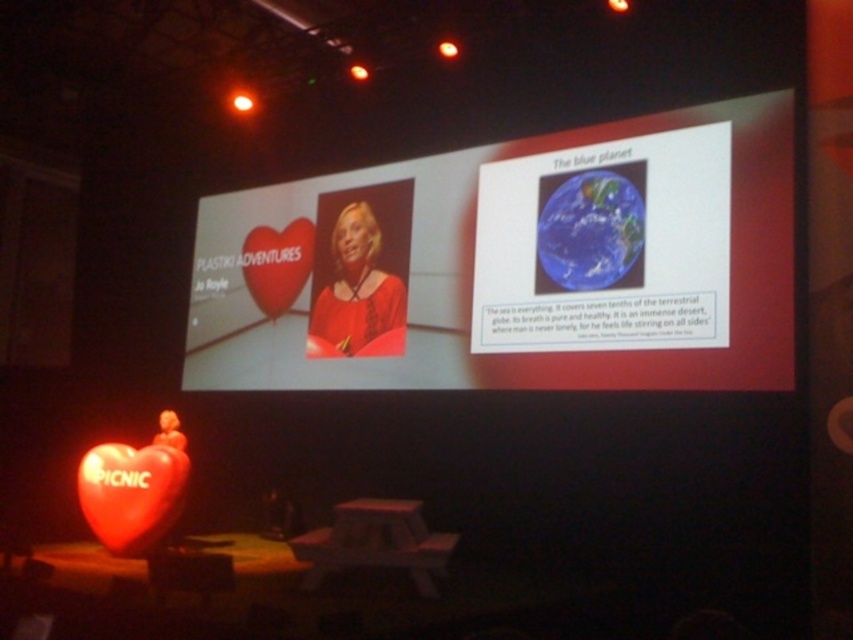
Question: Is white glossy projection screen at upper center in front of blue glossy earth at upper right?

Choices:
 (A) yes
 (B) no

Answer: (A)

Question: Based on their relative distances, which object is nearer to the blue glossy earth at upper right?

Choices:
 (A) matte red heart at center
 (B) white glossy projection screen at upper center

Answer: (B)

Question: Can you confirm if blue glossy earth at upper right is thinner than matte red heart at center?

Choices:
 (A) yes
 (B) no

Answer: (A)

Question: Which point is closer to the camera?

Choices:
 (A) (349, 198)
 (B) (567, 240)
 (C) (265, 276)

Answer: (B)

Question: Which point is closer to the camera?

Choices:
 (A) (699, 209)
 (B) (279, 312)
 (C) (590, 177)

Answer: (A)

Question: Does blue glossy earth at upper right have a larger size compared to matte red heart at center?

Choices:
 (A) yes
 (B) no

Answer: (A)